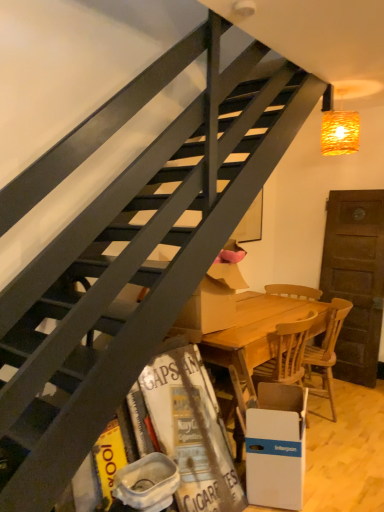
Question: Is white plastic trash bin/can at lower center at the left side of wooden at lower right, the 2th chair viewed from the left?

Choices:
 (A) no
 (B) yes

Answer: (B)

Question: Considering the relative sizes of white plastic trash bin/can at lower center and wooden at lower right, which appears as the 1th chair when viewed from the right, in the image provided, is white plastic trash bin/can at lower center smaller than wooden at lower right, which appears as the 1th chair when viewed from the right,?

Choices:
 (A) no
 (B) yes

Answer: (B)

Question: Is white plastic trash bin/can at lower center bigger than wooden at lower right, which appears as the 1th chair when viewed from the right?

Choices:
 (A) no
 (B) yes

Answer: (A)

Question: Is white plastic trash bin/can at lower center beside wooden at lower right, which appears as the 1th chair when viewed from the right?

Choices:
 (A) yes
 (B) no

Answer: (B)

Question: Is white plastic trash bin/can at lower center to the right of wooden at lower right, which appears as the 1th chair when viewed from the right, from the viewer's perspective?

Choices:
 (A) yes
 (B) no

Answer: (B)

Question: Is point (289, 387) positioned closer to the camera than point (342, 318)?

Choices:
 (A) farther
 (B) closer

Answer: (B)

Question: Choose the correct answer: Is white cardboard box at lower right inside wooden at lower right, which appears as the 1th chair when viewed from the right, or outside it?

Choices:
 (A) outside
 (B) inside

Answer: (A)

Question: From the image's perspective, relative to wooden at lower right, which appears as the 1th chair when viewed from the right, is white cardboard box at lower right above or below?

Choices:
 (A) below
 (B) above

Answer: (A)

Question: Is white cardboard box at lower right taller or shorter than wooden at lower right, the 2th chair viewed from the left?

Choices:
 (A) tall
 (B) short

Answer: (B)

Question: Considering the positions of wooden at lower right, which appears as the 1th chair when viewed from the right, and white cardboard box at lower right in the image, is wooden at lower right, which appears as the 1th chair when viewed from the right, bigger or smaller than white cardboard box at lower right?

Choices:
 (A) small
 (B) big

Answer: (B)

Question: From the image's perspective, is wooden at lower right, which appears as the 1th chair when viewed from the right, above or below white cardboard box at lower right?

Choices:
 (A) above
 (B) below

Answer: (A)

Question: Based on their positions, is wooden at lower right, which appears as the 1th chair when viewed from the right, located to the left or right of white cardboard box at lower right?

Choices:
 (A) left
 (B) right

Answer: (B)

Question: Is point (319, 369) closer or farther from the camera than point (286, 428)?

Choices:
 (A) closer
 (B) farther

Answer: (B)

Question: In terms of height, does white plastic trash bin/can at lower center look taller or shorter compared to white cardboard box at lower right?

Choices:
 (A) short
 (B) tall

Answer: (A)

Question: From the image's perspective, is white plastic trash bin/can at lower center located above or below white cardboard box at lower right?

Choices:
 (A) above
 (B) below

Answer: (A)